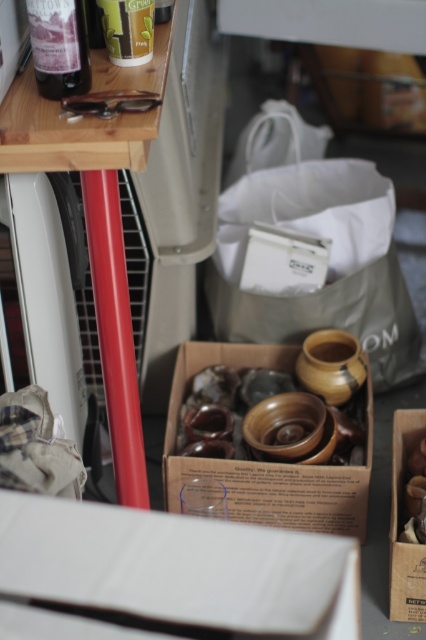
Question: Among these objects, which one is nearest to the camera?

Choices:
 (A) wooden box at lower right
 (B) translucent plastic cup at upper left
 (C) wooden spoon at center

Answer: (B)

Question: Can you confirm if wooden bowls at center is thinner than translucent plastic cup at upper left?

Choices:
 (A) yes
 (B) no

Answer: (B)

Question: Which object appears closest to the camera in this image?

Choices:
 (A) matte glass bottle at upper left
 (B) white cardboard box at lower center
 (C) wooden bowls at center

Answer: (B)

Question: Which point appears closest to the camera in this image?

Choices:
 (A) (46, 65)
 (B) (144, 24)
 (C) (417, 512)

Answer: (A)

Question: Is white cardboard box at lower center wider than wooden box at lower right?

Choices:
 (A) no
 (B) yes

Answer: (B)

Question: Does white cardboard box at lower center come behind wooden bowls at center?

Choices:
 (A) yes
 (B) no

Answer: (B)